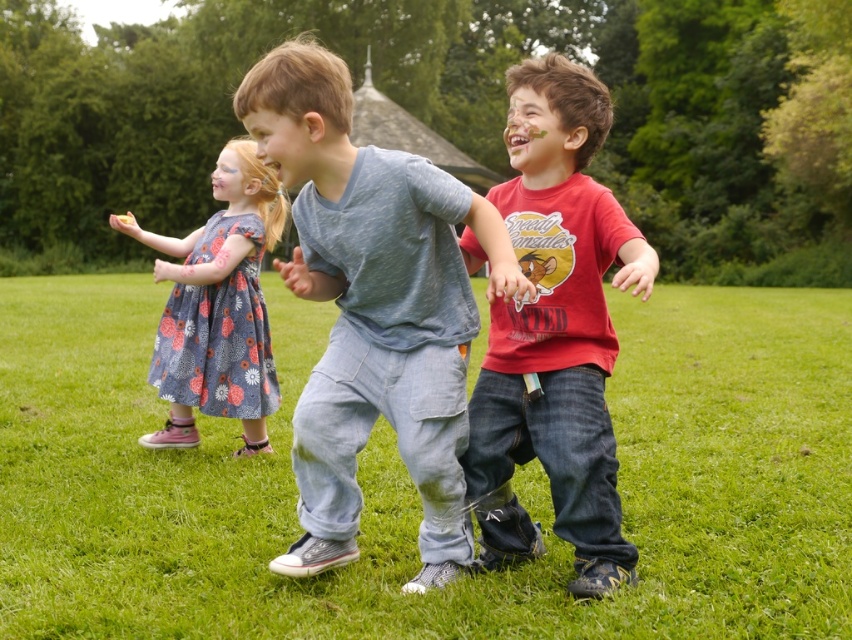
Is denim pants at center above floral-patterned dress at left?

Correct, denim pants at center is located above floral-patterned dress at left.

From the picture: Does denim pants at center have a greater width compared to floral-patterned dress at left?

Yes.

The height and width of the screenshot is (640, 852). Describe the element at coordinates (413, 488) in the screenshot. I see `denim pants at center` at that location.

Locate an element on the screen. The image size is (852, 640). denim pants at center is located at coordinates (413, 488).

Is denim pants at center further to camera compared to light blue cotton shirt at center?

Yes, it is.

Can you confirm if denim pants at center is positioned below light blue cotton shirt at center?

Actually, denim pants at center is above light blue cotton shirt at center.

Which is behind, point (770, 560) or point (427, 193)?

The point (770, 560) is behind.

This screenshot has height=640, width=852. I want to click on denim pants at center, so click(413, 488).

Is denim pants at center bigger than matte red t-shirt at center?

Correct, denim pants at center is larger in size than matte red t-shirt at center.

Does denim pants at center appear on the right side of matte red t-shirt at center?

No, denim pants at center is not to the right of matte red t-shirt at center.

Is point (751, 525) in front of point (629, 257)?

No, (751, 525) is further to viewer.

Where is `denim pants at center`? denim pants at center is located at coordinates (413, 488).